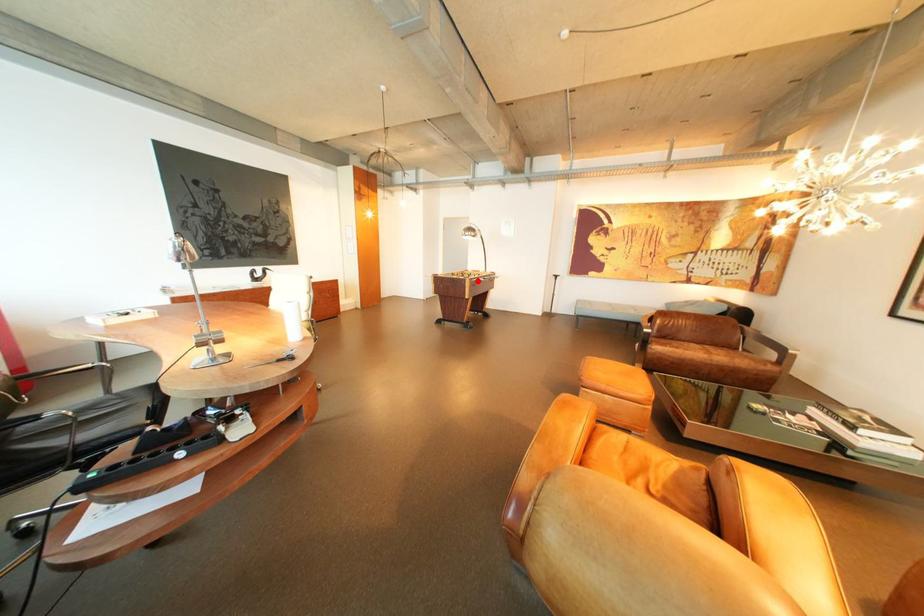
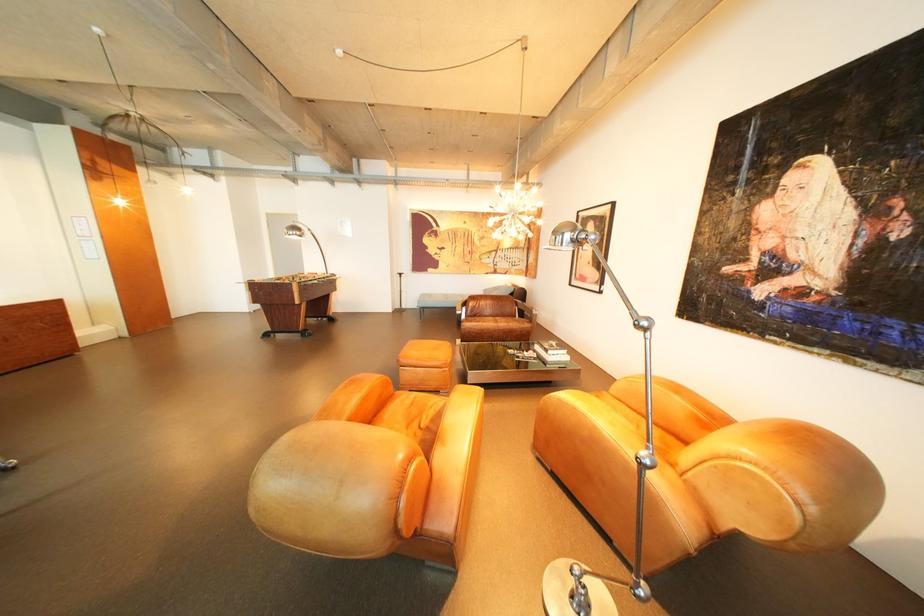
Question: I am providing you with two images of the same scene from different viewpoints. Image1 has a red point marked. In image2, the corresponding 3D location appears at what relative position? Reply with the corresponding letter.

Choices:
 (A) Closer
 (B) Farther

Answer: (A)